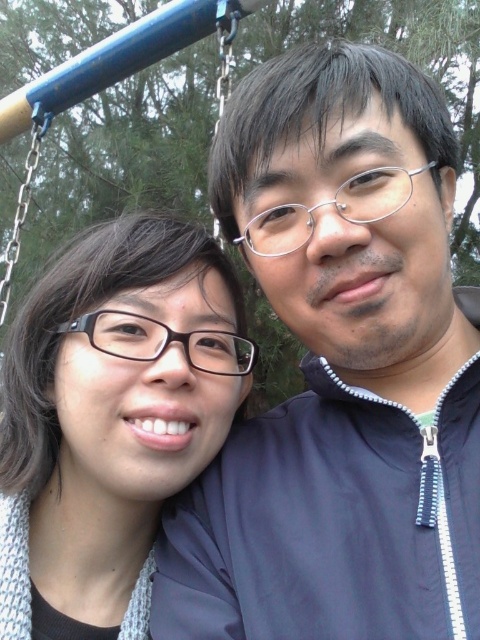
Is point (428, 214) closer to camera compared to point (188, 445)?

Yes.

The width and height of the screenshot is (480, 640). Describe the element at coordinates (339, 371) in the screenshot. I see `matte blue jacket at upper right` at that location.

Which is in front, point (381, 625) or point (177, 483)?

Point (381, 625) is more forward.

Locate an element on the screen. matte blue jacket at upper right is located at coordinates coord(339,371).